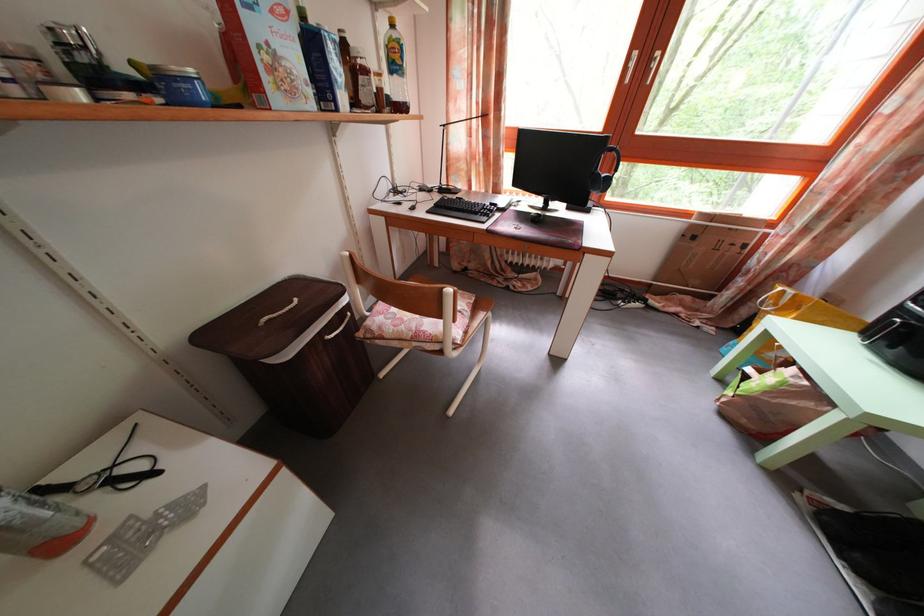
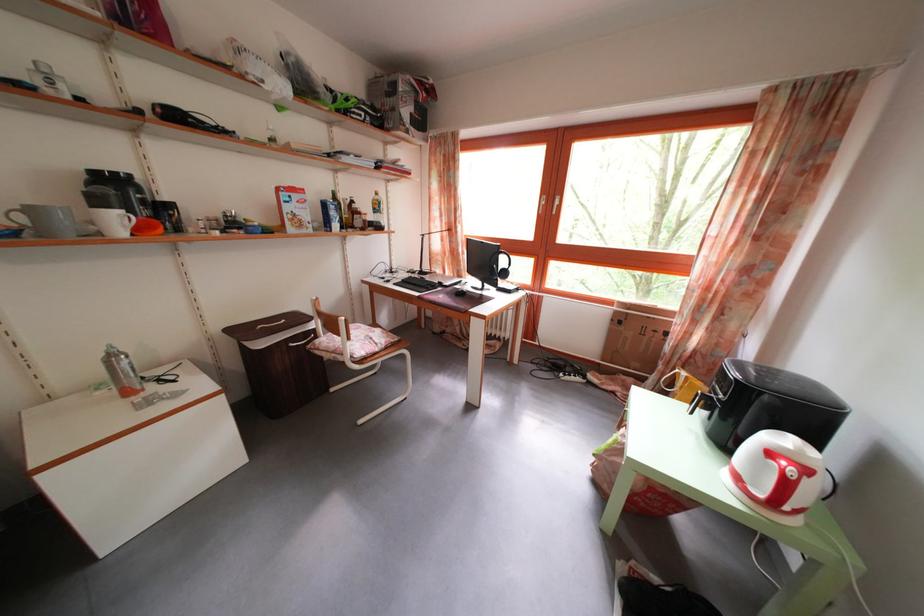
The point at (511, 217) is marked in the first image. Where is the corresponding point in the second image?

(454, 294)